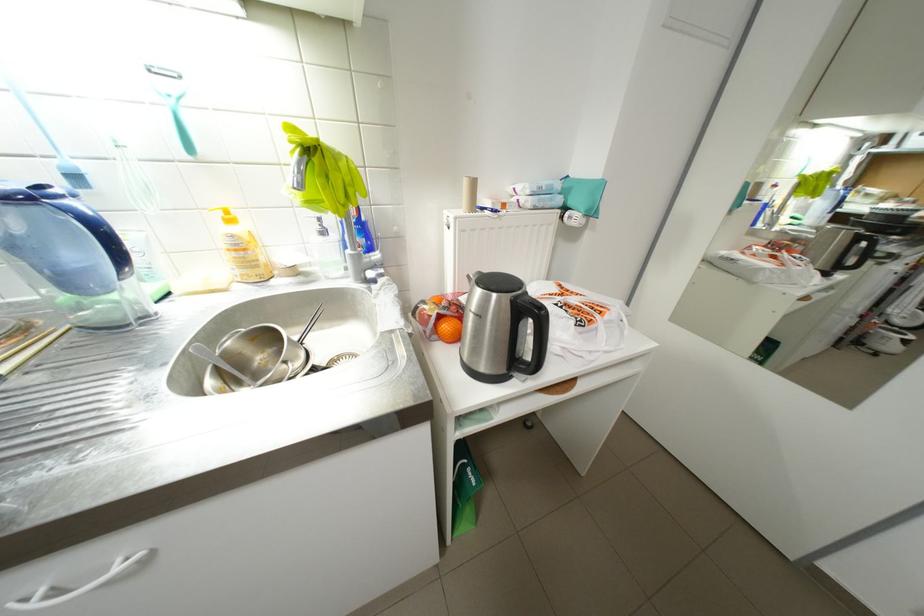
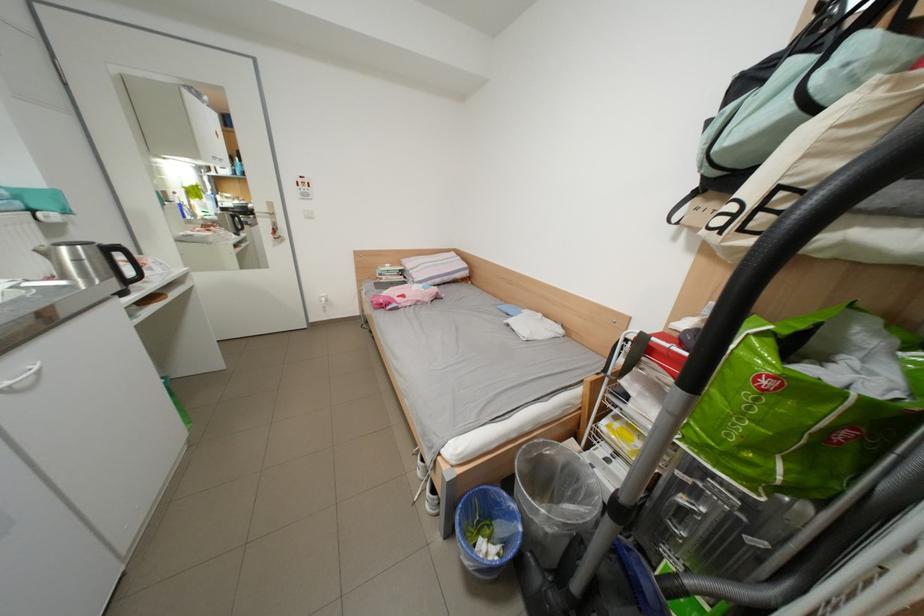
The point at (128, 570) is marked in the first image. Where is the corresponding point in the second image?

(46, 369)